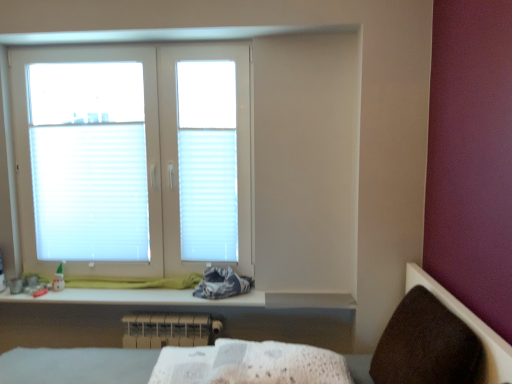
Question: Considering their positions, is white plastic radiator at lower center located in front of or behind white pleated blind at upper left, which is the 2th blind in right-to-left order?

Choices:
 (A) front
 (B) behind

Answer: (A)

Question: Considering the positions of white plastic radiator at lower center and white pleated blind at upper left, acting as the 1th blind starting from the left, in the image, is white plastic radiator at lower center wider or thinner than white pleated blind at upper left, acting as the 1th blind starting from the left,?

Choices:
 (A) wide
 (B) thin

Answer: (A)

Question: Which of these objects is positioned closest to the white plastic radiator at lower center?

Choices:
 (A) white plastic window at upper left
 (B) white pleated blind at center, which is the first blind from right to left
 (C) white textured fabric at lower center
 (D) brown fabric armchair at lower right
 (E) white pleated blind at upper left, acting as the 1th blind starting from the left

Answer: (B)

Question: Which object is positioned closest to the white textured fabric at lower center?

Choices:
 (A) brown fabric armchair at lower right
 (B) white plastic radiator at lower center
 (C) white glossy changing table at lower center
 (D) white pleated blind at upper left, which is the 2th blind in right-to-left order
 (E) white pleated blind at center, which is the first blind from right to left

Answer: (A)